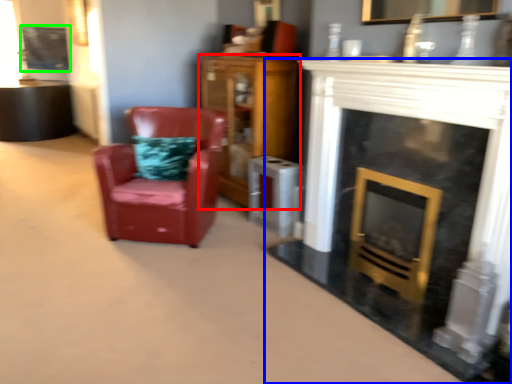
Question: Which is farther away from cabinetry (highlighted by a red box)? fireplace (highlighted by a blue box) or picture frame (highlighted by a green box)?

Choices:
 (A) fireplace
 (B) picture frame

Answer: (B)